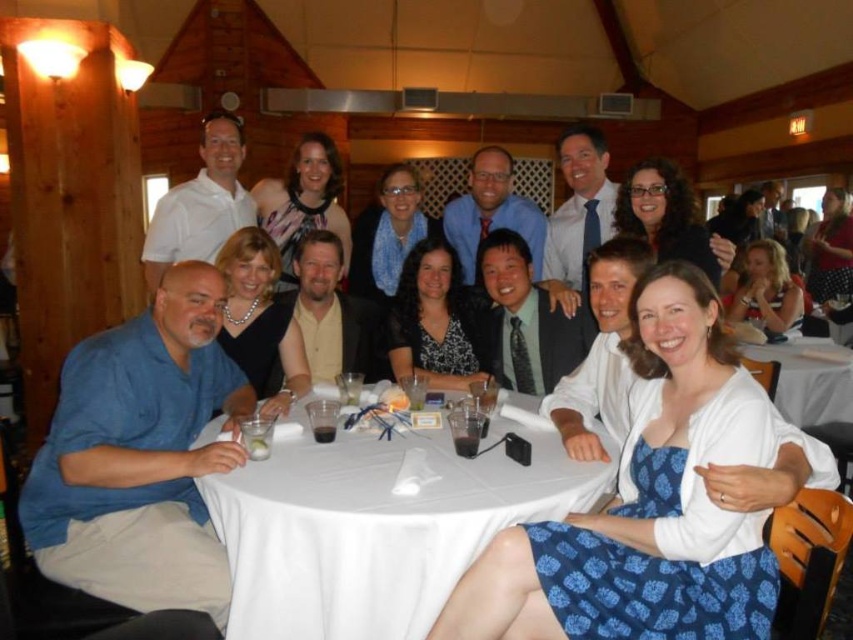
Question: Where is white cloth at center located in relation to white cloth at lower right in the image?

Choices:
 (A) below
 (B) above

Answer: (A)

Question: Is white cloth at center to the left of white cloth at lower right from the viewer's perspective?

Choices:
 (A) yes
 (B) no

Answer: (A)

Question: In this image, where is white cloth at center located relative to white cloth at lower right?

Choices:
 (A) below
 (B) above

Answer: (A)

Question: Which point is closer to the camera?

Choices:
 (A) (802, 342)
 (B) (369, 445)

Answer: (B)

Question: Which point is closer to the camera?

Choices:
 (A) white cloth at center
 (B) white cloth at lower right

Answer: (A)